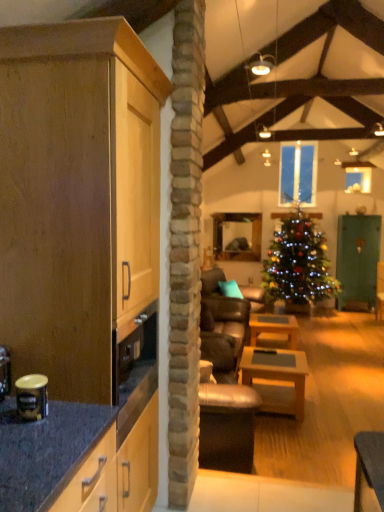
Question: From the image's perspective, is shiny green christmas tree at center above or below green matte cabinet at right?

Choices:
 (A) above
 (B) below

Answer: (A)

Question: Based on their sizes in the image, would you say shiny green christmas tree at center is bigger or smaller than green matte cabinet at right?

Choices:
 (A) small
 (B) big

Answer: (B)

Question: Which is nearer to the shiny green christmas tree at center?

Choices:
 (A) clear glass window at center
 (B) green matte cabinet at right
 (C) light wood cabinet at left
 (D) wooden table at center, which is the 1th table in front-to-back order
 (E) teal fabric pillow at center

Answer: (B)

Question: Which of these objects is positioned closest to the wooden table at center, acting as the second table starting from the back?

Choices:
 (A) clear glass window at center
 (B) shiny green christmas tree at center
 (C) light wood cabinet at left
 (D) metallic gold canister at left
 (E) wooden table at center, which is counted as the second table, starting from the front

Answer: (E)